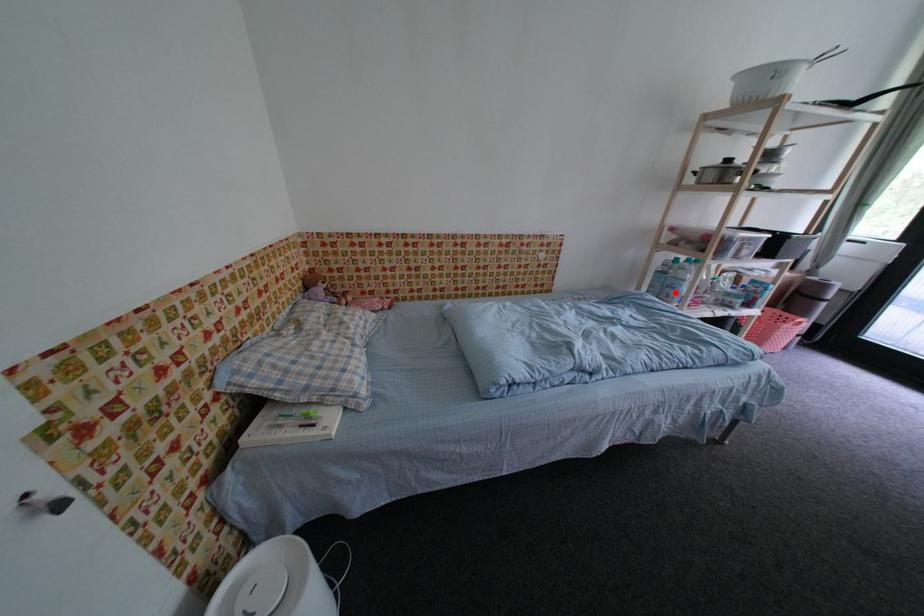
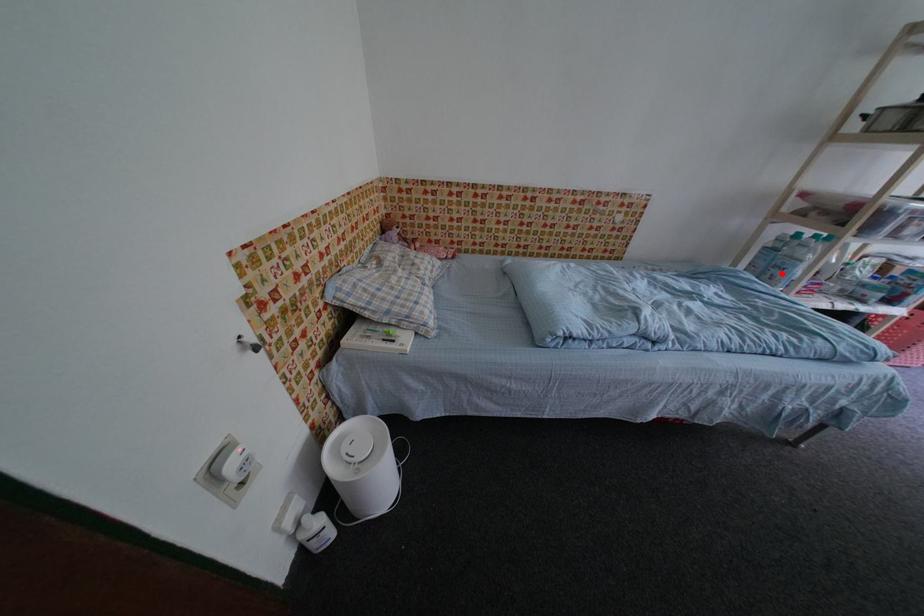
I am providing you with two images of the same scene from different viewpoints. A red point is marked on the first image and another point is marked on the second image. Are the points marked in image1 and image2 representing the same 3D position?

Yes